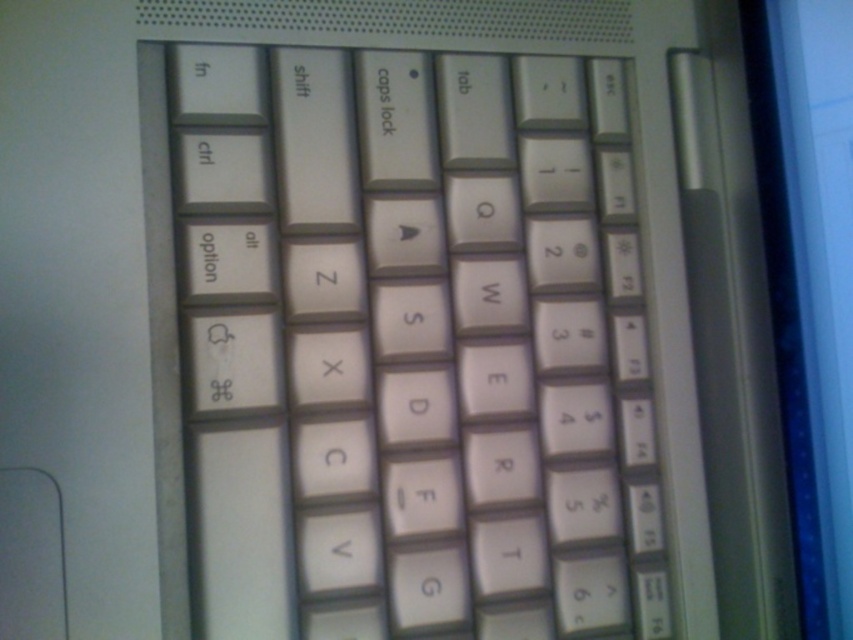
Question: Can you confirm if white plastic keyboard at center is thinner than matte plastic screen at right?

Choices:
 (A) no
 (B) yes

Answer: (A)

Question: Which object is closer to the camera taking this photo?

Choices:
 (A) matte plastic screen at right
 (B) white plastic keyboard at center

Answer: (B)

Question: Which point appears farthest from the camera in this image?

Choices:
 (A) (566, 445)
 (B) (776, 64)

Answer: (B)

Question: Is white plastic keyboard at center closer to the viewer compared to matte plastic screen at right?

Choices:
 (A) no
 (B) yes

Answer: (B)

Question: Where is white plastic keyboard at center located in relation to matte plastic screen at right in the image?

Choices:
 (A) above
 (B) below

Answer: (B)